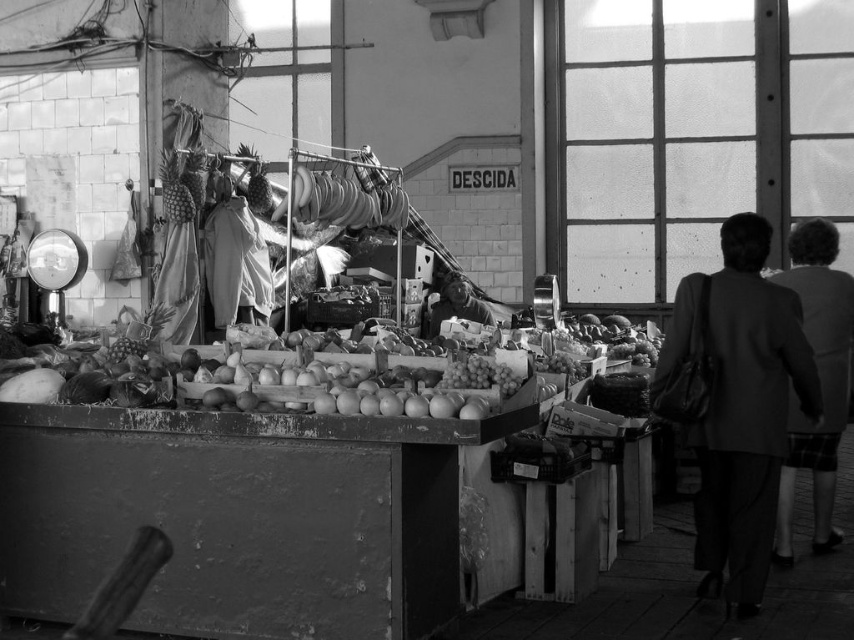
You are a photographer trying to capture a candid shot of the smooth skin face at center without including the plaid skirt at right in the frame. Based on their sizes, is it possible to do so?

The plaid skirt at right has a larger size compared to smooth skin face at center, so it might be challenging to exclude the plaid skirt at right while focusing on the smooth skin face at center due to its bigger presence in the frame.